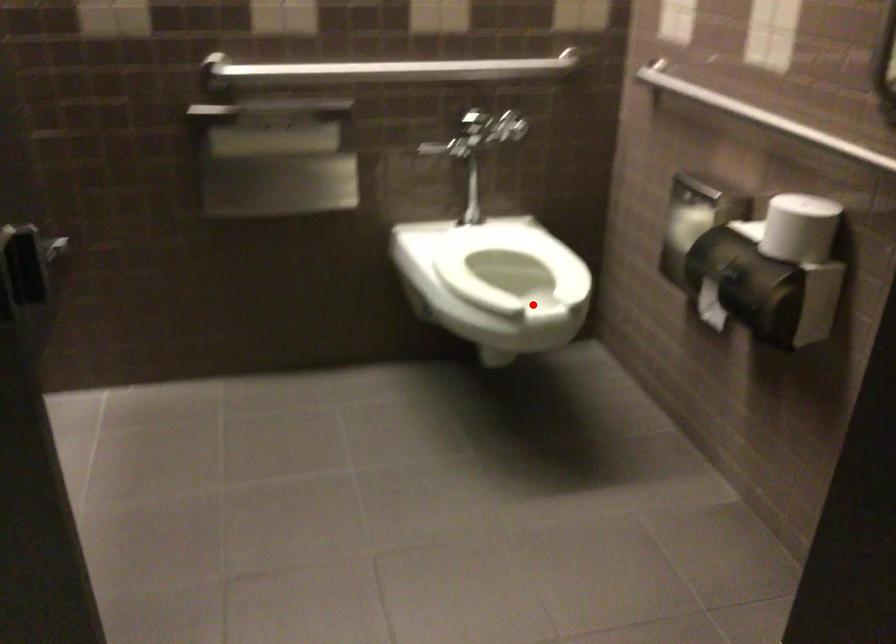
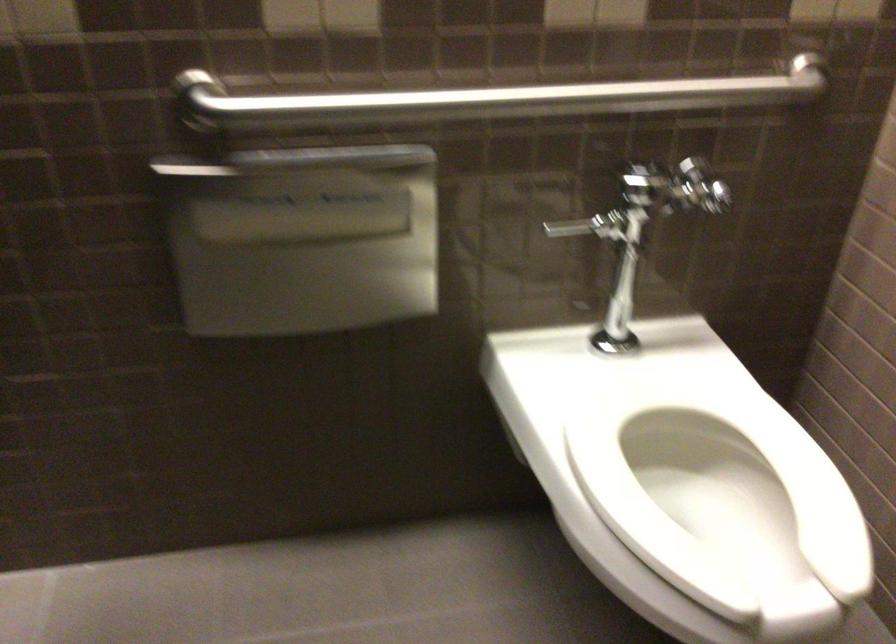
Locate, in the second image, the point that corresponds to the highlighted location in the first image.

(719, 494)